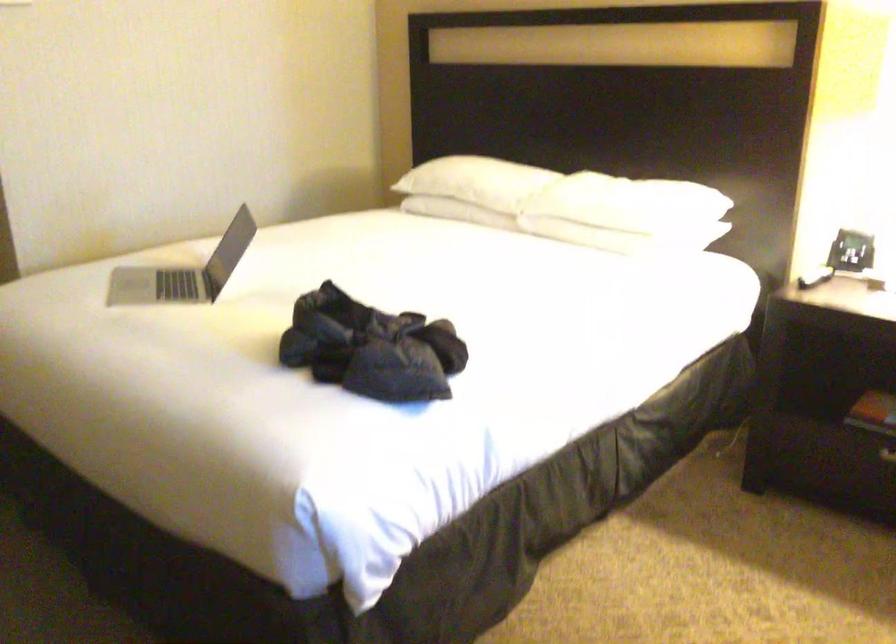
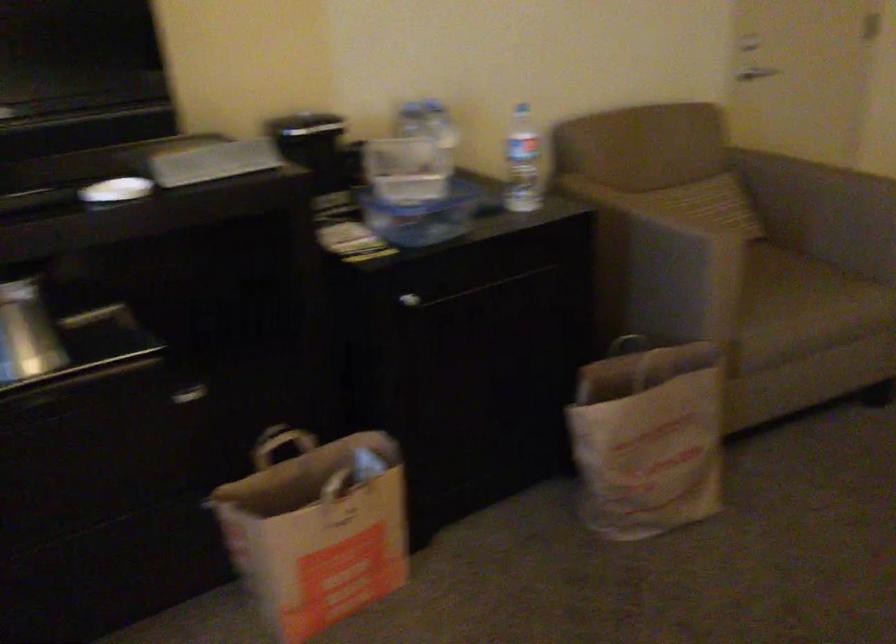
Based on the continuous images, in which direction is the camera rotating?

The camera's rotation is toward left-down.